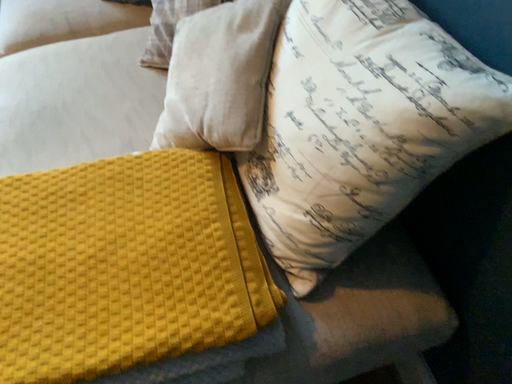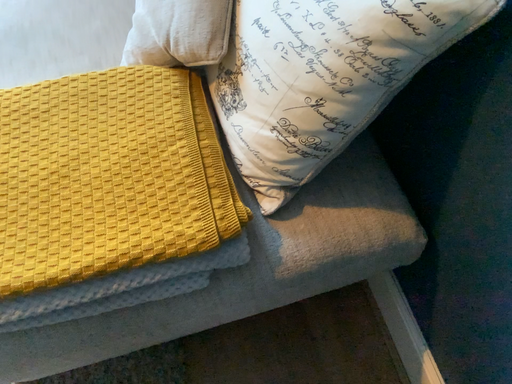
Question: How did the camera likely rotate when shooting the video?

Choices:
 (A) rotated downward
 (B) rotated upward

Answer: (A)